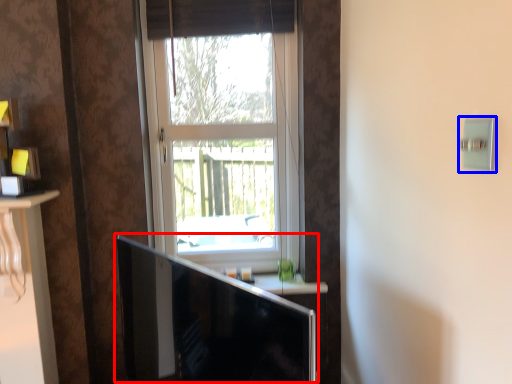
Question: Which object is closer to the camera taking this photo, computer monitor (highlighted by a red box) or light switch (highlighted by a blue box)?

Choices:
 (A) computer monitor
 (B) light switch

Answer: (A)